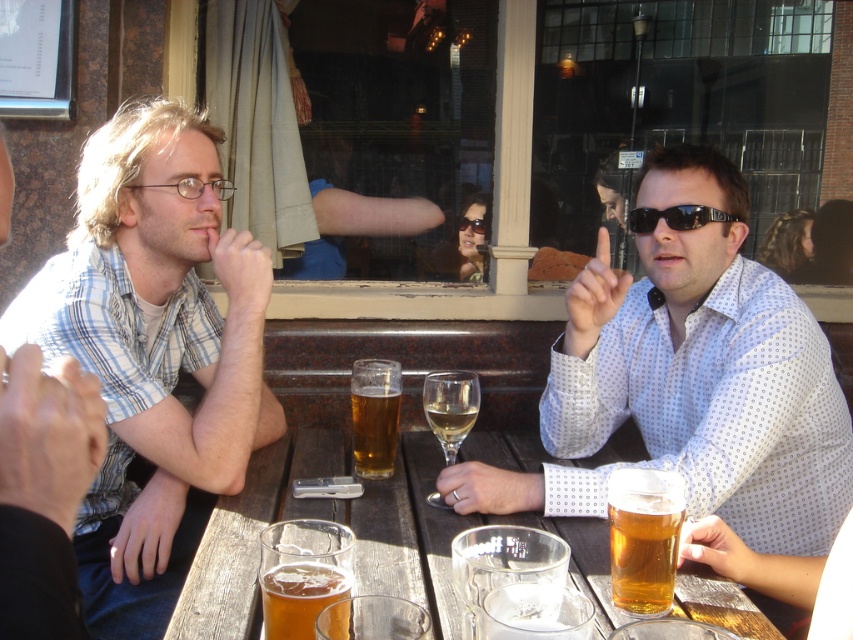
Is point (10, 433) farther from camera compared to point (379, 387)?

No, it is in front of (379, 387).

Describe the element at coordinates (44, 490) in the screenshot. This screenshot has width=853, height=640. I see `plaid shirt at left` at that location.

Is point (9, 385) positioned before point (383, 371)?

Yes, point (9, 385) is closer to viewer.

At what (x,y) coordinates should I click in order to perform the action: click on plaid shirt at left. Please return your answer as a coordinate pair (x, y). This screenshot has width=853, height=640. Looking at the image, I should click on pos(44,490).

Does polka dot shirt at right appear on the left side of black plastic sunglasses at center?

In fact, polka dot shirt at right is to the right of black plastic sunglasses at center.

Can you confirm if polka dot shirt at right is smaller than black plastic sunglasses at center?

No, polka dot shirt at right is not smaller than black plastic sunglasses at center.

Which is in front, point (657, 305) or point (677, 228)?

Point (677, 228)

At what (x,y) coordinates should I click in order to perform the action: click on polka dot shirt at right. Please return your answer as a coordinate pair (x, y). This screenshot has width=853, height=640. Looking at the image, I should click on pos(706,369).

Does point (672, 492) come in front of point (699, 211)?

That is True.

Does golden glass beer at lower center have a greater width compared to black plastic sunglasses at center?

In fact, golden glass beer at lower center might be narrower than black plastic sunglasses at center.

Which is behind, point (608, 499) or point (647, 214)?

Point (647, 214)

Where is `golden glass beer at lower center`? This screenshot has height=640, width=853. golden glass beer at lower center is located at coordinates (643, 550).